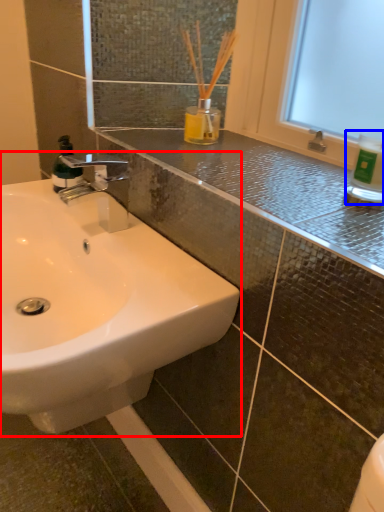
Question: Which object appears closest to the camera in this image, sink (highlighted by a red box) or bottle (highlighted by a blue box)?

Choices:
 (A) sink
 (B) bottle

Answer: (A)